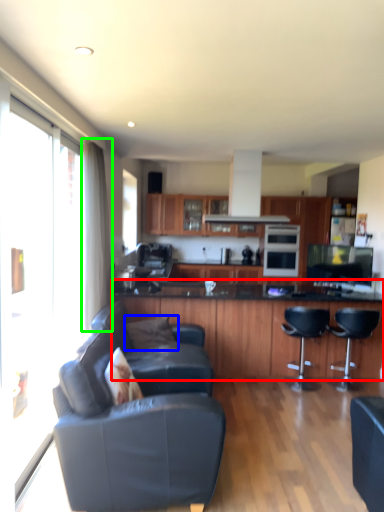
Question: Which object is positioned closest to cabinetry (highlighted by a red box)? Select from pillow (highlighted by a blue box) and curtain (highlighted by a green box).

Choices:
 (A) pillow
 (B) curtain

Answer: (A)